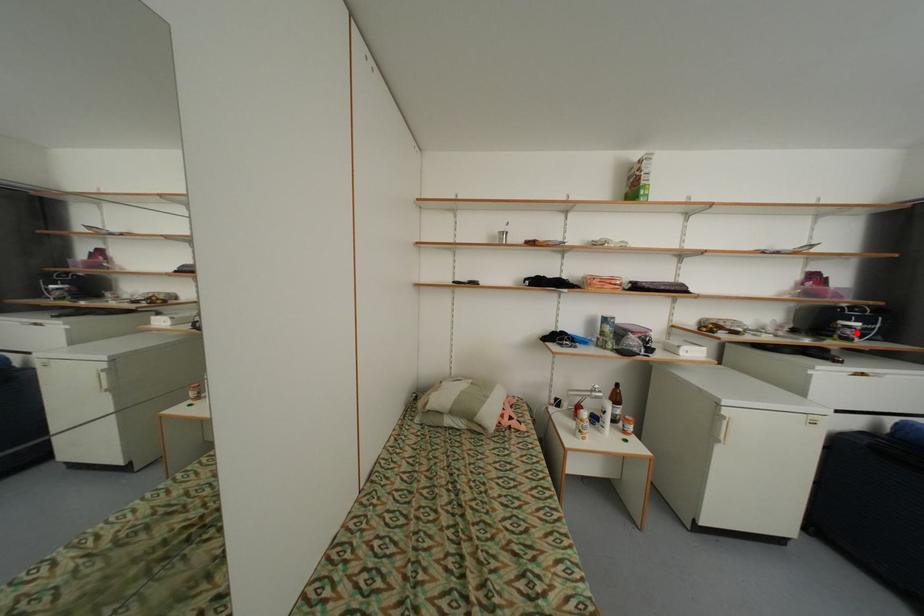
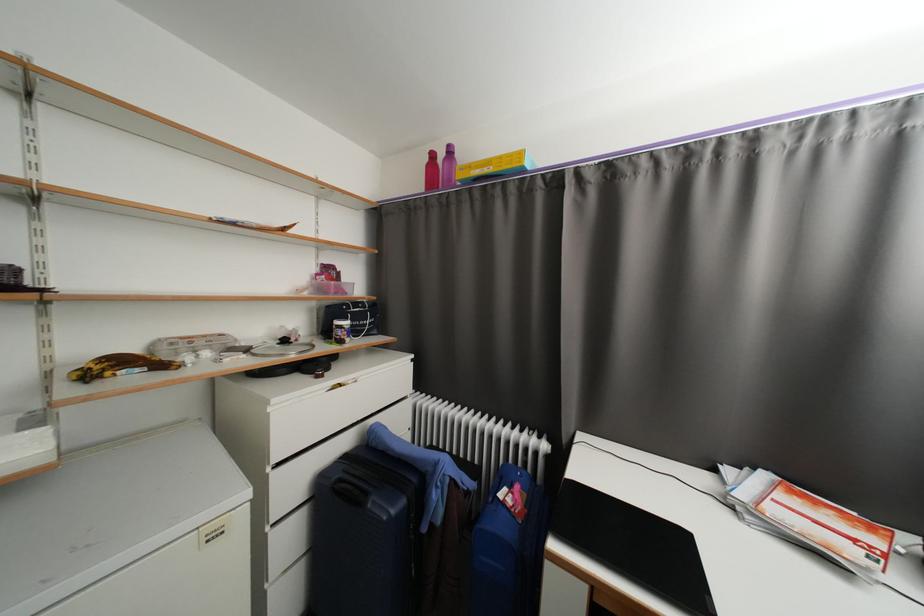
The point at the highlighted location is marked in the first image. Where is the corresponding point in the second image?

(346, 334)